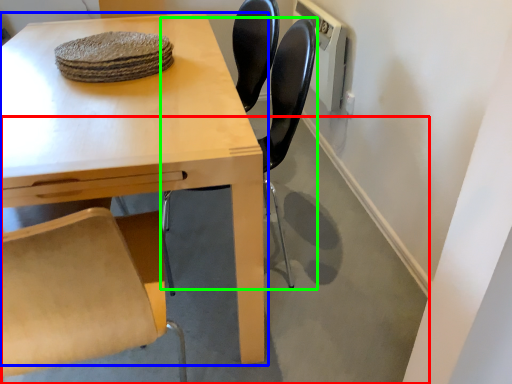
Question: Estimate the real-world distances between objects in this image. Which object is closer to concrete (highlighted by a red box), table (highlighted by a blue box) or chair (highlighted by a green box)?

Choices:
 (A) table
 (B) chair

Answer: (A)